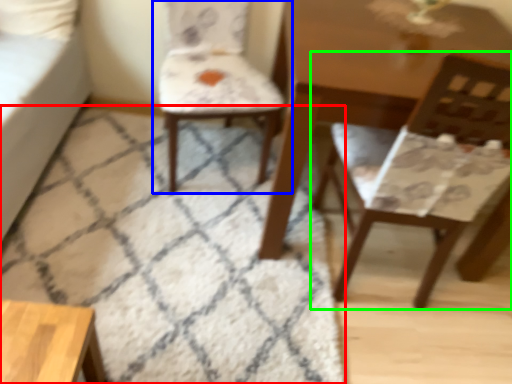
Question: Estimate the real-world distances between objects in this image. Which object is farther from mat (highlighted by a red box), chair (highlighted by a blue box) or chair (highlighted by a green box)?

Choices:
 (A) chair
 (B) chair

Answer: (B)